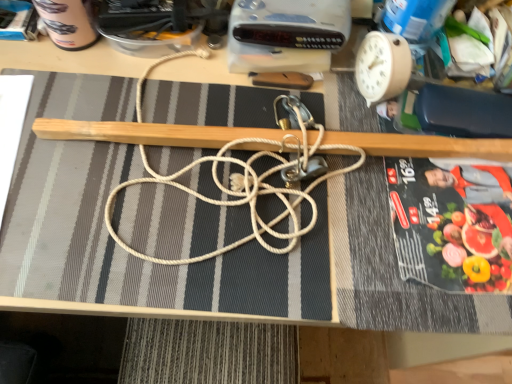
Locate an element on the screen. This screenshot has width=512, height=384. empty space that is ontop of white rope at center (from a real-world perspective) is located at coordinates (234, 143).